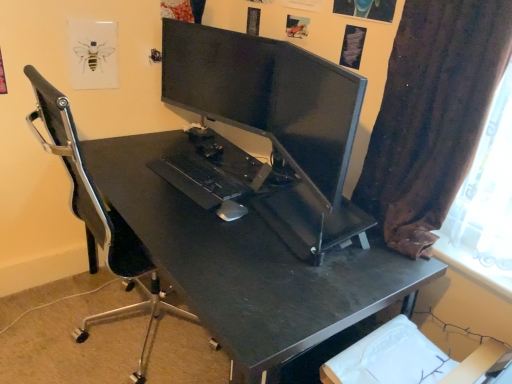
Question: Relative to brown fabric curtain at right, is black matte desk at center in front or behind?

Choices:
 (A) front
 (B) behind

Answer: (B)

Question: Does point (224, 274) appear closer or farther from the camera than point (465, 41)?

Choices:
 (A) farther
 (B) closer

Answer: (A)

Question: Which object is the closest to the black matte desk at center?

Choices:
 (A) brown fabric curtain at right
 (B) white matte mouse at center

Answer: (B)

Question: Which is farther from the black matte desk at center?

Choices:
 (A) white matte mouse at center
 (B) brown fabric curtain at right

Answer: (B)